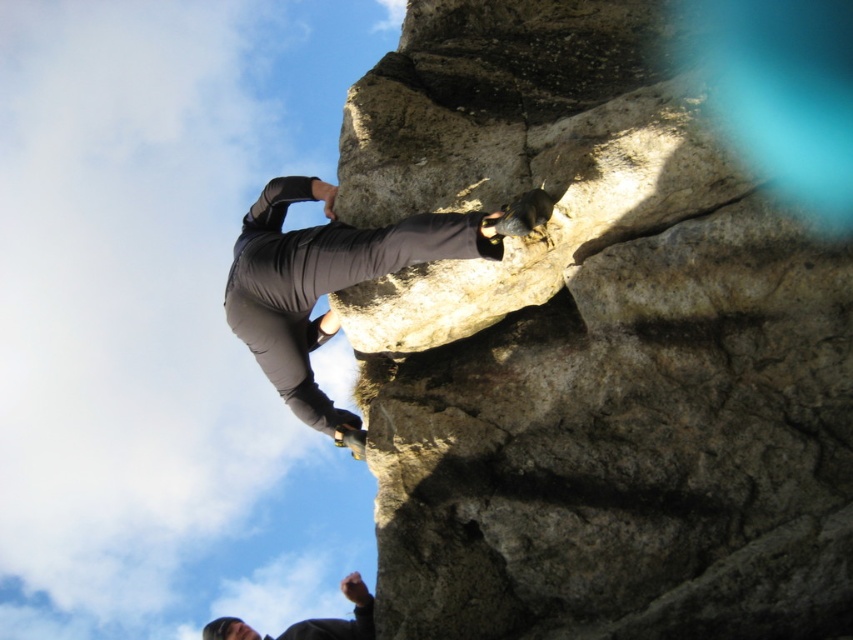
Is gray matte pants at center smaller than dark gray fabric pants at upper center?

Yes.

Which is in front, point (280, 262) or point (367, 589)?

Point (280, 262) is in front.

Is point (432, 224) farther from viewer compared to point (370, 621)?

No, it is in front of (370, 621).

You are a GUI agent. You are given a task and a screenshot of the screen. Output one action in this format:
    pyautogui.click(x=<x>, y=<y>)
    Task: Click on the gray matte pants at center
    Image resolution: width=853 pixels, height=640 pixels.
    Given the screenshot: What is the action you would take?
    pyautogui.click(x=338, y=280)

Does rough stone cliff at center lie in front of gray matte pants at center?

That is True.

Which is more to the right, rough stone cliff at center or gray matte pants at center?

rough stone cliff at center is more to the right.

Does point (527, 253) lie in front of point (311, 406)?

Yes, it is.

The width and height of the screenshot is (853, 640). What are the coordinates of `rough stone cliff at center` in the screenshot? It's located at (590, 348).

Is point (613, 100) behind point (323, 621)?

No, it is in front of (323, 621).

Is rough stone cliff at center bigger than dark gray fabric pants at upper center?

No.

Which is in front, point (473, 346) or point (322, 621)?

Point (473, 346) is in front.

This screenshot has width=853, height=640. I want to click on rough stone cliff at center, so click(x=590, y=348).